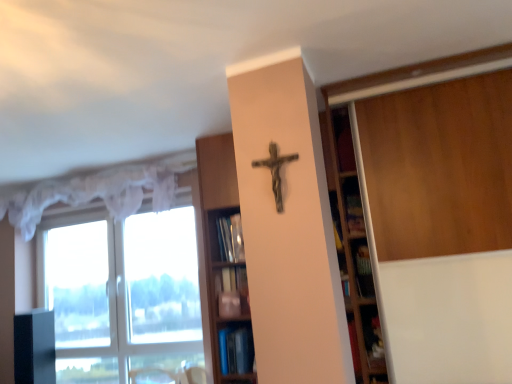
Question: Is wooden bookshelf at center, the second shelf from the bottom, facing away from blue glossy bookshelf at lower center, placed as the 1th shelf when sorted from bottom to top?

Choices:
 (A) yes
 (B) no

Answer: (A)

Question: Can you confirm if wooden bookshelf at center, the second shelf from the bottom, is thinner than blue glossy bookshelf at lower center, placed as the 1th shelf when sorted from bottom to top?

Choices:
 (A) no
 (B) yes

Answer: (A)

Question: Is wooden bookshelf at center, arranged as the first shelf when viewed from the top, in front of blue glossy bookshelf at lower center, placed as the second shelf when sorted from top to bottom?

Choices:
 (A) no
 (B) yes

Answer: (B)

Question: From the image's perspective, does wooden bookshelf at center, arranged as the first shelf when viewed from the top, appear lower than blue glossy bookshelf at lower center, placed as the 1th shelf when sorted from bottom to top?

Choices:
 (A) yes
 (B) no

Answer: (B)

Question: Is there a large distance between wooden bookshelf at center, arranged as the first shelf when viewed from the top, and blue glossy bookshelf at lower center, placed as the 1th shelf when sorted from bottom to top?

Choices:
 (A) no
 (B) yes

Answer: (A)

Question: Is wooden bookshelf at center, the second shelf from the bottom, to the left of blue glossy bookshelf at lower center, placed as the 1th shelf when sorted from bottom to top, from the viewer's perspective?

Choices:
 (A) yes
 (B) no

Answer: (A)

Question: Considering the relative positions of blue glossy bookshelf at lower center, placed as the 1th shelf when sorted from bottom to top, and rusty metal crucifix at center in the image provided, is blue glossy bookshelf at lower center, placed as the 1th shelf when sorted from bottom to top, in front of rusty metal crucifix at center?

Choices:
 (A) no
 (B) yes

Answer: (A)

Question: Can you confirm if blue glossy bookshelf at lower center, placed as the second shelf when sorted from top to bottom, is bigger than rusty metal crucifix at center?

Choices:
 (A) yes
 (B) no

Answer: (A)

Question: Is blue glossy bookshelf at lower center, placed as the second shelf when sorted from top to bottom, directly adjacent to rusty metal crucifix at center?

Choices:
 (A) no
 (B) yes

Answer: (A)

Question: Can you confirm if blue glossy bookshelf at lower center, placed as the second shelf when sorted from top to bottom, is thinner than rusty metal crucifix at center?

Choices:
 (A) no
 (B) yes

Answer: (A)

Question: Is blue glossy bookshelf at lower center, placed as the 1th shelf when sorted from bottom to top, behind rusty metal crucifix at center?

Choices:
 (A) no
 (B) yes

Answer: (B)

Question: Is blue glossy bookshelf at lower center, placed as the 1th shelf when sorted from bottom to top, looking in the opposite direction of rusty metal crucifix at center?

Choices:
 (A) no
 (B) yes

Answer: (A)

Question: Can you confirm if rusty metal crucifix at center is smaller than blue glossy bookshelf at lower center, placed as the 1th shelf when sorted from bottom to top?

Choices:
 (A) yes
 (B) no

Answer: (A)